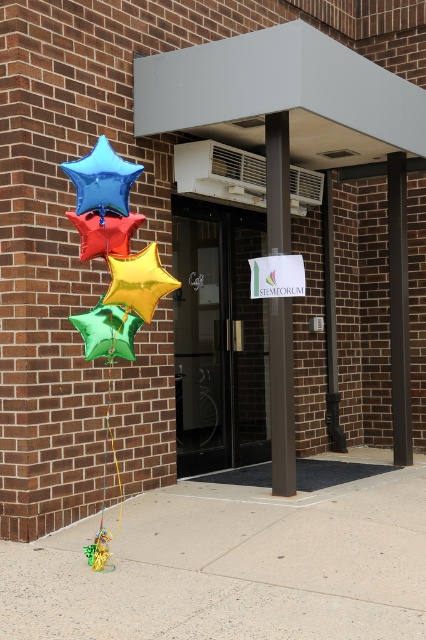
You are a visitor approaching the entrance of the building and want to find the STEM FORUM sign. Which object should you look at first, the brown polished pillar at center or the yellow metallic string at left?

The brown polished pillar at center is much taller than the yellow metallic string at left, so you should look at the brown polished pillar at center first because it is taller and more prominent.

You are standing at the entrance of the building and want to place a small decorative item exactly at the point marked by the coordinates point (236, 563). According to the scene description, what is the surface type at that location?

The surface type at point (236, 563) is smooth concrete pavement, as indicated by the Objects Description.

You are standing at the entrance of the building and want to place a small decorative item between the brown polished pillar at center and the shiny red star at left. Considering their sizes, which object should the item be placed closer to?

The brown polished pillar at center is larger than the shiny red star at left, so the small decorative item should be placed closer to the shiny red star at left to maintain balance.